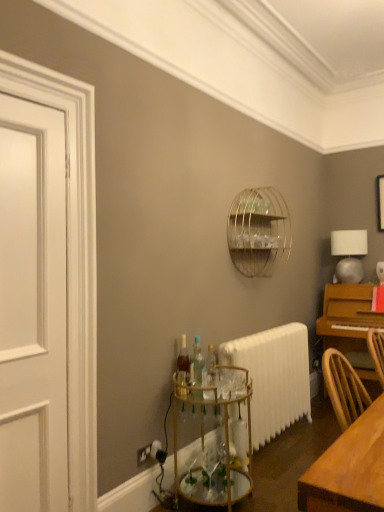
Question: Does gold metallic bar cart at lower center have a lesser width compared to clear glass bottles at center, acting as the 2th bottle starting from the back?

Choices:
 (A) no
 (B) yes

Answer: (A)

Question: Considering the relative positions of gold metallic bar cart at lower center and clear glass bottles at center, acting as the 2th bottle starting from the back, in the image provided, is gold metallic bar cart at lower center behind clear glass bottles at center, acting as the 2th bottle starting from the back,?

Choices:
 (A) no
 (B) yes

Answer: (A)

Question: Is gold metallic bar cart at lower center facing towards clear glass bottles at center, which is the first bottle from front to back?

Choices:
 (A) no
 (B) yes

Answer: (A)

Question: From the image's perspective, is gold metallic bar cart at lower center beneath clear glass bottles at center, acting as the 2th bottle starting from the back?

Choices:
 (A) no
 (B) yes

Answer: (B)

Question: Is gold metallic bar cart at lower center taller than clear glass bottles at center, acting as the 2th bottle starting from the back?

Choices:
 (A) no
 (B) yes

Answer: (B)

Question: Is point (235, 262) positioned closer to the camera than point (195, 376)?

Choices:
 (A) closer
 (B) farther

Answer: (B)

Question: Considering their positions, is gold wire birdcage at upper center located in front of or behind clear glass bottles at center, acting as the 2th bottle starting from the back?

Choices:
 (A) behind
 (B) front

Answer: (A)

Question: From a real-world perspective, relative to clear glass bottles at center, acting as the 2th bottle starting from the back, is gold wire birdcage at upper center vertically above or below?

Choices:
 (A) above
 (B) below

Answer: (A)

Question: From the image's perspective, relative to clear glass bottles at center, which is the first bottle from front to back, is gold wire birdcage at upper center above or below?

Choices:
 (A) below
 (B) above

Answer: (B)

Question: Looking at the image, does gold metallic bar cart at lower center seem bigger or smaller compared to white painted radiator at lower center?

Choices:
 (A) small
 (B) big

Answer: (A)

Question: From a real-world perspective, is gold metallic bar cart at lower center physically located above or below white painted radiator at lower center?

Choices:
 (A) below
 (B) above

Answer: (A)

Question: Is gold metallic bar cart at lower center taller or shorter than white painted radiator at lower center?

Choices:
 (A) short
 (B) tall

Answer: (A)

Question: In the image, is gold metallic bar cart at lower center on the left side or the right side of white painted radiator at lower center?

Choices:
 (A) left
 (B) right

Answer: (A)

Question: From the image's perspective, is white painted wood door at left located above or below translucent glass bottle at center, the 2th bottle in the front-to-back sequence?

Choices:
 (A) above
 (B) below

Answer: (A)

Question: Considering their positions, is white painted wood door at left located in front of or behind translucent glass bottle at center, the 2th bottle in the front-to-back sequence?

Choices:
 (A) behind
 (B) front

Answer: (B)